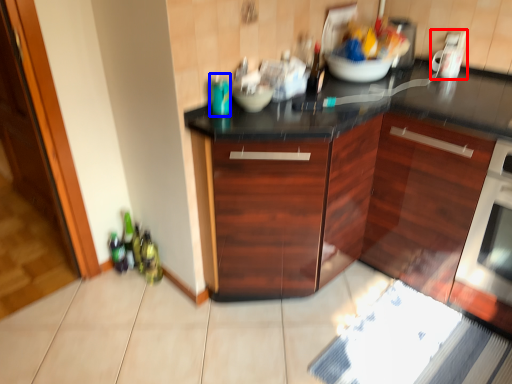
Question: Among these objects, which one is nearest to the camera, appliance (highlighted by a red box) or bottle (highlighted by a blue box)?

Choices:
 (A) appliance
 (B) bottle

Answer: (B)